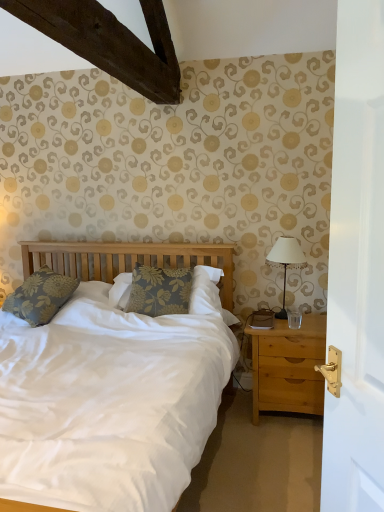
Find the location of `free space above light brown wood nightstand at right (from a real-world perspective)`. free space above light brown wood nightstand at right (from a real-world perspective) is located at coordinates (291, 317).